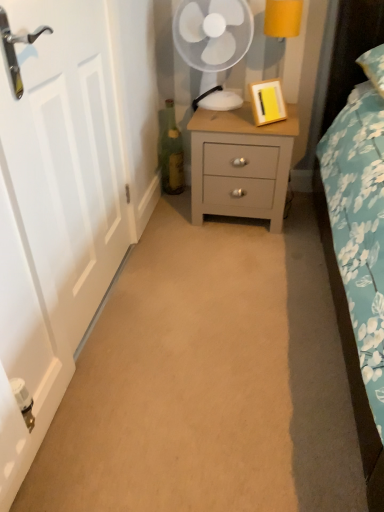
Where is `free space in front of matte gray nightstand at center`? The image size is (384, 512). free space in front of matte gray nightstand at center is located at coordinates (246, 253).